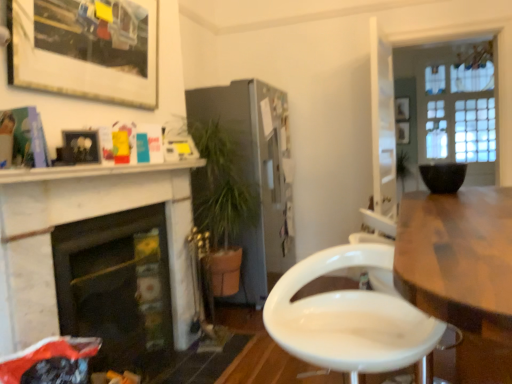
Consider the image. In order to face matte black picture frame at upper left, the fourth picture frame from the top, should I rotate leftwards or rightwards?

Turn left approximately 22.333 degrees to face it.

In order to click on wooden picture frame at upper right, the 3th picture frame viewed from the front in this screenshot , I will do pos(402,109).

Where is `black glass fireplace at left, acting as the second fireplace starting from the front`? black glass fireplace at left, acting as the second fireplace starting from the front is located at coordinates (117, 288).

The image size is (512, 384). Describe the element at coordinates (117, 288) in the screenshot. I see `black glass fireplace at left, acting as the second fireplace starting from the front` at that location.

Find the location of a particular element. The height and width of the screenshot is (384, 512). wooden table at right is located at coordinates (462, 271).

Is white marble fireplace at left, which ranks as the 1th fireplace in front-to-back order, completely or partially outside of satin silver refrigerator at center?

Yes.

Consider the image. From the image's perspective, which one is positioned lower, white marble fireplace at left, which ranks as the 1th fireplace in front-to-back order, or satin silver refrigerator at center?

white marble fireplace at left, which ranks as the 1th fireplace in front-to-back order.

From a real-world perspective, is white marble fireplace at left, which ranks as the 1th fireplace in front-to-back order, above or below satin silver refrigerator at center?

In terms of real-world spatial position, white marble fireplace at left, which ranks as the 1th fireplace in front-to-back order, is below satin silver refrigerator at center.

Can you confirm if black glass fireplace at left, acting as the second fireplace starting from the front, is bigger than matte black picture frame at upper left, positioned as the second picture frame in front-to-back order?

Indeed, black glass fireplace at left, acting as the second fireplace starting from the front, has a larger size compared to matte black picture frame at upper left, positioned as the second picture frame in front-to-back order.

Measure the distance between black glass fireplace at left, acting as the second fireplace starting from the front, and matte black picture frame at upper left, the first picture frame positioned from the bottom.

They are 26.51 inches apart.

Looking at this image, considering the sizes of objects black glass fireplace at left, acting as the second fireplace starting from the front, and matte black picture frame at upper left, acting as the 3th picture frame starting from the back, in the image provided, who is wider, black glass fireplace at left, acting as the second fireplace starting from the front, or matte black picture frame at upper left, acting as the 3th picture frame starting from the back,?

black glass fireplace at left, acting as the second fireplace starting from the front.

Visually, is black glass fireplace at left, the 1th fireplace viewed from the back, positioned to the left or to the right of matte black picture frame at upper left, the second picture frame positioned from the left?

From the image, it's evident that black glass fireplace at left, the 1th fireplace viewed from the back, is to the right of matte black picture frame at upper left, the second picture frame positioned from the left.

From a real-world perspective, is white marble shelf at upper left positioned above or below wooden picture frame at upper right, arranged as the second picture frame when viewed from the back?

From a real-world perspective, white marble shelf at upper left is physically below wooden picture frame at upper right, arranged as the second picture frame when viewed from the back.

Does white marble shelf at upper left appear on the right side of wooden picture frame at upper right, arranged as the second picture frame when viewed from the back?

No.

Which object is thinner, satin silver refrigerator at center or black glass fireplace at left, acting as the second fireplace starting from the front?

With smaller width is black glass fireplace at left, acting as the second fireplace starting from the front.

From the image's perspective, is satin silver refrigerator at center above or below black glass fireplace at left, the 1th fireplace viewed from the back?

From the image's perspective, satin silver refrigerator at center appears above black glass fireplace at left, the 1th fireplace viewed from the back.

Which object is positioned more to the right, satin silver refrigerator at center or black glass fireplace at left, acting as the second fireplace starting from the front?

Positioned to the right is satin silver refrigerator at center.

Considering the positions of points (227, 91) and (125, 349), is point (227, 91) closer to camera compared to point (125, 349)?

No, it is not.

Looking at this image, from a real-world perspective, who is located lower, wooden picture frame at upper right, which is the 1th picture frame in back-to-front order, or white glossy chair at center?

white glossy chair at center.

Which of these two, wooden picture frame at upper right, which is the 1th picture frame from right to left, or white glossy chair at center, is smaller?

wooden picture frame at upper right, which is the 1th picture frame from right to left, is smaller.

Which of these two, wooden picture frame at upper right, marked as the second picture frame in a top-to-bottom arrangement, or white glossy chair at center, stands taller?

With more height is white glossy chair at center.

Does point (408, 125) appear closer or farther from the camera than point (296, 309)?

Point (408, 125) is positioned farther from the camera compared to point (296, 309).

Consider the image. Considering the sizes of objects wooden picture frame at upper right, the 4th picture frame in the front-to-back sequence, and white marble fireplace at left, which is the second fireplace from back to front, in the image provided, who is wider, wooden picture frame at upper right, the 4th picture frame in the front-to-back sequence, or white marble fireplace at left, which is the second fireplace from back to front,?

white marble fireplace at left, which is the second fireplace from back to front, is wider.

From a real-world perspective, between wooden picture frame at upper right, which is the 1th picture frame from right to left, and white marble fireplace at left, which is the second fireplace from back to front, who is vertically lower?

From a 3D spatial view, white marble fireplace at left, which is the second fireplace from back to front, is below.

Is wooden picture frame at upper right, marked as the second picture frame in a top-to-bottom arrangement, inside or outside of white marble fireplace at left, which is the second fireplace from back to front?

wooden picture frame at upper right, marked as the second picture frame in a top-to-bottom arrangement, is not inside white marble fireplace at left, which is the second fireplace from back to front, it's outside.

Does point (401, 141) come farther from viewer compared to point (34, 333)?

That is True.

From a real-world perspective, who is located lower, wooden table at right or white marble shelf at upper left?

wooden table at right, from a real-world perspective.

This screenshot has height=384, width=512. I want to click on counter top above the wooden table at right (from the image's perspective), so click(91, 171).

Does wooden table at right have a greater width compared to white marble shelf at upper left?

Indeed, wooden table at right has a greater width compared to white marble shelf at upper left.

From the picture: Does wooden table at right have a larger size compared to white marble shelf at upper left?

Yes, wooden table at right is bigger than white marble shelf at upper left.

From a real-world perspective, starting from the satin silver refrigerator at center, which fireplace is the 1st one below it? Please provide its 2D coordinates.

[(80, 220)]

In order to click on fireplace that is the 2nd object located below the matte black picture frame at upper left, the second picture frame positioned from the left (from the image's perspective) in this screenshot , I will do `click(117, 288)`.

Considering their positions, is wooden picture frame at upper right, the 4th picture frame in the front-to-back sequence, positioned further to white marble fireplace at left, which is the second fireplace from back to front, than white marble shelf at upper left?

wooden picture frame at upper right, the 4th picture frame in the front-to-back sequence, is further to white marble fireplace at left, which is the second fireplace from back to front.

Based on their spatial positions, is matte black picture frame at upper left, positioned as the third picture frame in right-to-left order, or white marble fireplace at left, which ranks as the 1th fireplace in front-to-back order, closer to wooden picture frame at upper right, which is the 1th picture frame from right to left?

white marble fireplace at left, which ranks as the 1th fireplace in front-to-back order, is positioned closer to the anchor wooden picture frame at upper right, which is the 1th picture frame from right to left.

Looking at the image, which one is located further to white marble shelf at upper left, black glass fireplace at left, the 1th fireplace viewed from the back, or white marble fireplace at left, which ranks as the 1th fireplace in front-to-back order?

The object further to white marble shelf at upper left is black glass fireplace at left, the 1th fireplace viewed from the back.

Consider the image. When comparing their distances from clear glass door at upper right, does wooden picture frame at upper right, arranged as the second picture frame when viewed from the back, or white marble shelf at upper left seem further?

white marble shelf at upper left.

Which object lies further to the anchor point wooden picture frame at upper right, the fourth picture frame from the left, wooden table at right or matte black picture frame at upper left, acting as the 3th picture frame starting from the back?

Among the two, matte black picture frame at upper left, acting as the 3th picture frame starting from the back, is located further to wooden picture frame at upper right, the fourth picture frame from the left.

In the scene shown: From the image, which object appears to be nearer to clear glass door at upper right, wooden picture frame at upper right, which is the 1th picture frame from right to left, or satin silver refrigerator at center?

wooden picture frame at upper right, which is the 1th picture frame from right to left, is closer to clear glass door at upper right.

Estimate the real-world distances between objects in this image. Which object is closer to white marble fireplace at left, which is the second fireplace from back to front, white marble shelf at upper left or wooden picture frame at upper right, arranged as the second picture frame when viewed from the back?

Among the two, white marble shelf at upper left is located nearer to white marble fireplace at left, which is the second fireplace from back to front.

From the image, which object appears to be farther from white glossy chair at center, satin silver refrigerator at center or white marble fireplace at left, which ranks as the 1th fireplace in front-to-back order?

Based on the image, satin silver refrigerator at center appears to be further to white glossy chair at center.

Identify the location of cabinetry situated between matte white picture frame at upper left, the first picture frame positioned from the left, and black matte bowl at upper right from left to right. (254, 172).

Where is `flowerpot between satin silver refrigerator at center and clear glass door at upper right from left to right`? The height and width of the screenshot is (384, 512). flowerpot between satin silver refrigerator at center and clear glass door at upper right from left to right is located at coordinates (443, 176).

Locate an element on the screen. The height and width of the screenshot is (384, 512). chair between matte white picture frame at upper left, acting as the 3th picture frame starting from the top, and white marble fireplace at left, which is the second fireplace from back to front, vertically is located at coordinates (350, 319).

What are the coordinates of `picture frame situated between matte white picture frame at upper left, acting as the 3th picture frame starting from the top, and black matte bowl at upper right from left to right` in the screenshot? It's located at (80, 147).